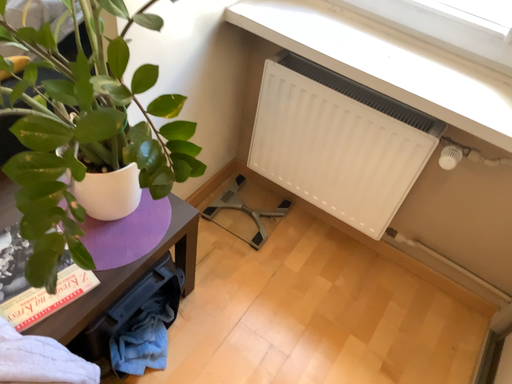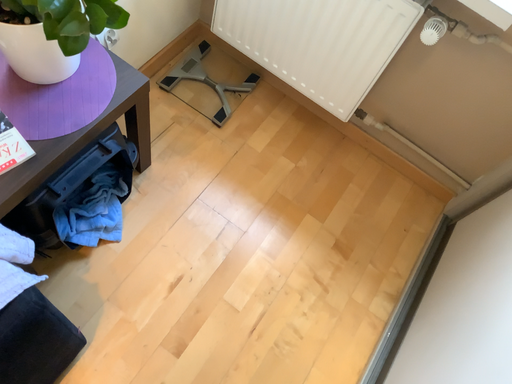
Question: How did the camera likely rotate when shooting the video?

Choices:
 (A) rotated downward
 (B) rotated upward

Answer: (A)